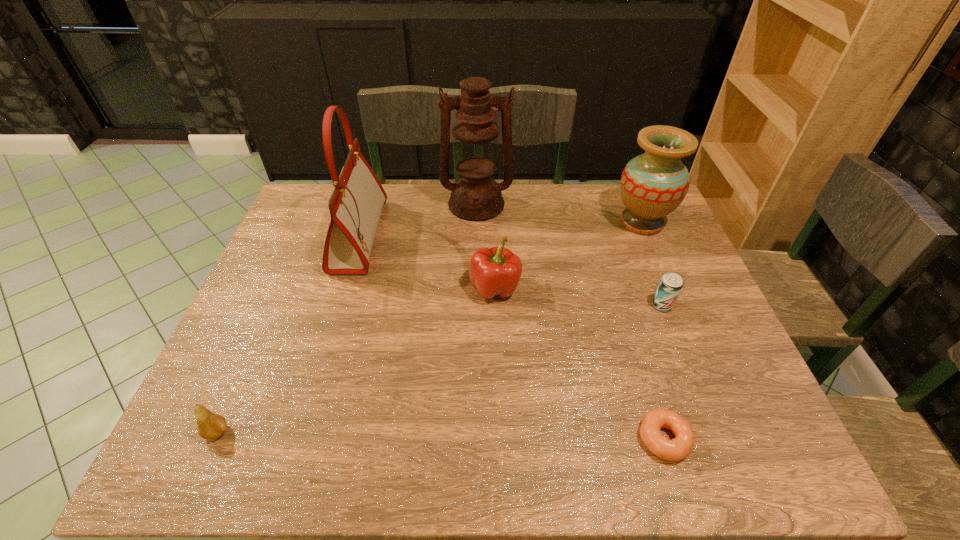
Identify the location of vacant space located 0.070m on the left of the fourth shortest object. The image size is (960, 540). (444, 288).

Locate an element on the screen. vacant area situated on the left of the beer can is located at coordinates (550, 306).

The height and width of the screenshot is (540, 960). I want to click on free region located on the right of the leftmost object, so click(306, 432).

This screenshot has width=960, height=540. I want to click on vacant space located 0.100m on the right of the doughnut, so click(737, 439).

Where is `oil lamp that is at the far edge`? The height and width of the screenshot is (540, 960). oil lamp that is at the far edge is located at coordinates (476, 196).

Image resolution: width=960 pixels, height=540 pixels. What are the coordinates of `handbag located in the far edge section of the desktop` in the screenshot? It's located at (356, 204).

This screenshot has height=540, width=960. Find the location of `vase present at the far edge`. vase present at the far edge is located at coordinates (653, 184).

Locate an element on the screen. Image resolution: width=960 pixels, height=540 pixels. pear at the near edge is located at coordinates (210, 425).

Image resolution: width=960 pixels, height=540 pixels. I want to click on doughnut that is at the near edge, so click(x=679, y=448).

Identify the location of object that is at the left edge. (210, 425).